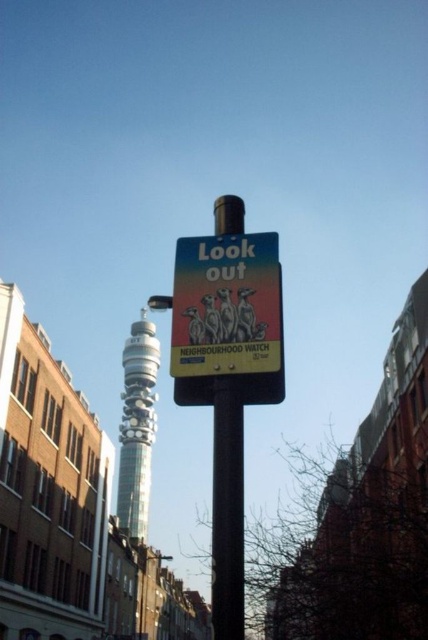
You are a city planner assessing the street layout. You need to install a new streetlight that must be narrower than the existing structures. Which object between the smooth metallic pole at center and the silver metallic bt tower at center should you choose to place the new streetlight next to, ensuring it doesn

The smooth metallic pole at center has a lesser width compared to the silver metallic bt tower at center. Therefore, the new streetlight should be placed next to the smooth metallic pole at center to ensure it is narrower than the existing structures.

You are standing at the center of the image. Which direction should you move to get closer to the smooth metallic pole at center?

The smooth metallic pole at center is already at the center of the image, so you don not need to move in any direction to get closer to it.

You are a city planner assessing the street layout. You need to determine if the smooth metallic pole at center will block the view of the silver metallic bt tower at center from the sidewalk. Based on their heights, can you confirm if the pole will obscure the tower?

The smooth metallic pole at center is shorter than the silver metallic bt tower at center, so the pole will not block the view of the tower from the sidewalk.